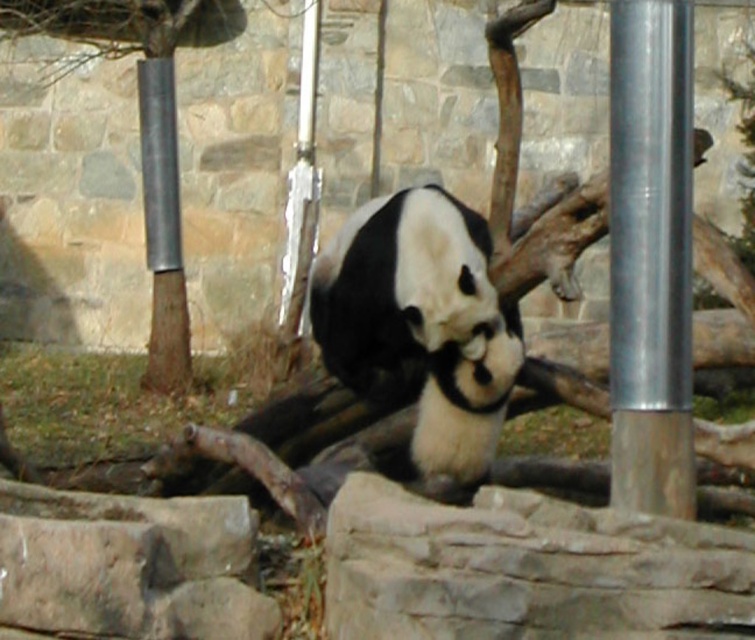
In the scene shown: You are a zookeeper trying to secure a new enclosure for pandas. You have two poles, the metallic smooth pole at left and the silver metallic pole at center, to choose from. Which pole should you select if you need a wider pole for better visibility around the panda?

The metallic smooth pole at left is wider than the silver metallic pole at center, so you should select the metallic smooth pole at left for better visibility around the panda.